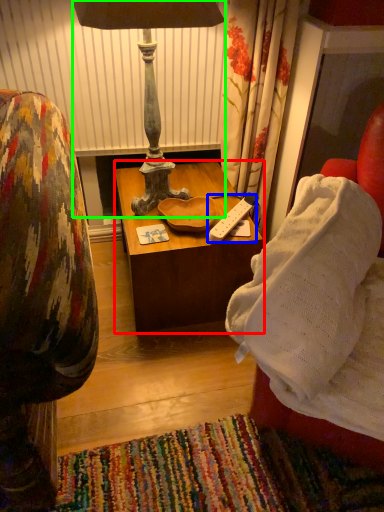
Question: Which object is positioned closest to table (highlighted by a red box)? Select from remote (highlighted by a blue box) and lamp (highlighted by a green box).

Choices:
 (A) remote
 (B) lamp

Answer: (A)